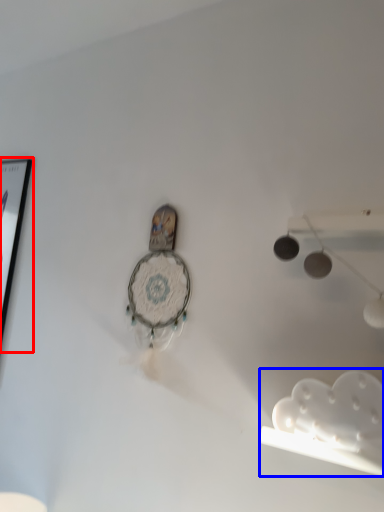
Question: Which object is closer to the camera taking this photo, picture frame (highlighted by a red box) or lamp (highlighted by a blue box)?

Choices:
 (A) picture frame
 (B) lamp

Answer: (B)